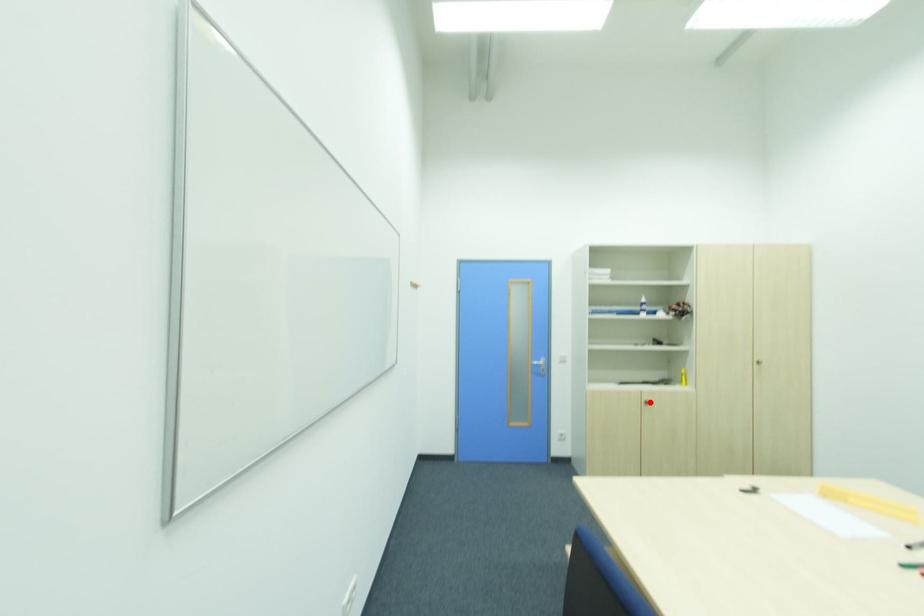
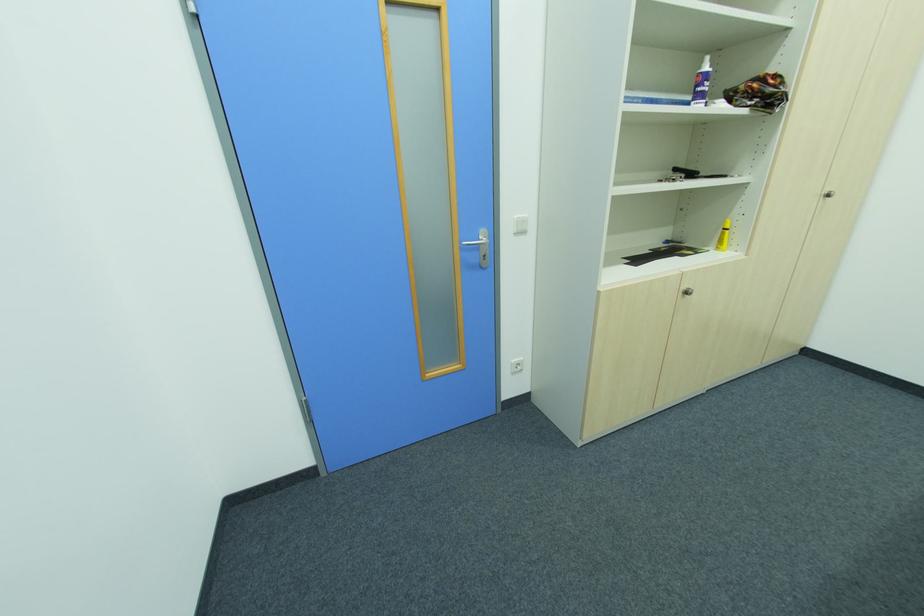
Question: I am providing you with two images of the same scene from different viewpoints. A red point is shown in image1. For the corresponding object point in image2, is it positioned nearer or farther from the camera?

Choices:
 (A) Nearer
 (B) Farther

Answer: (A)